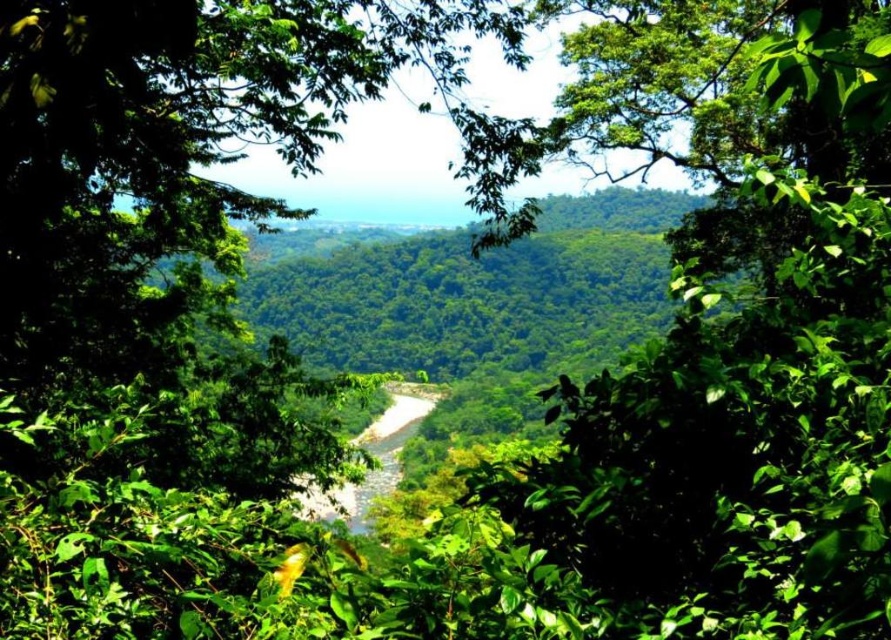
Does green leafy tree at center appear on the right side of green leafy forest at center?

Yes, green leafy tree at center is to the right of green leafy forest at center.

Is point (748, 97) farther from camera compared to point (399, 289)?

No.

Find the location of `green leafy tree at center`. green leafy tree at center is located at coordinates (742, 356).